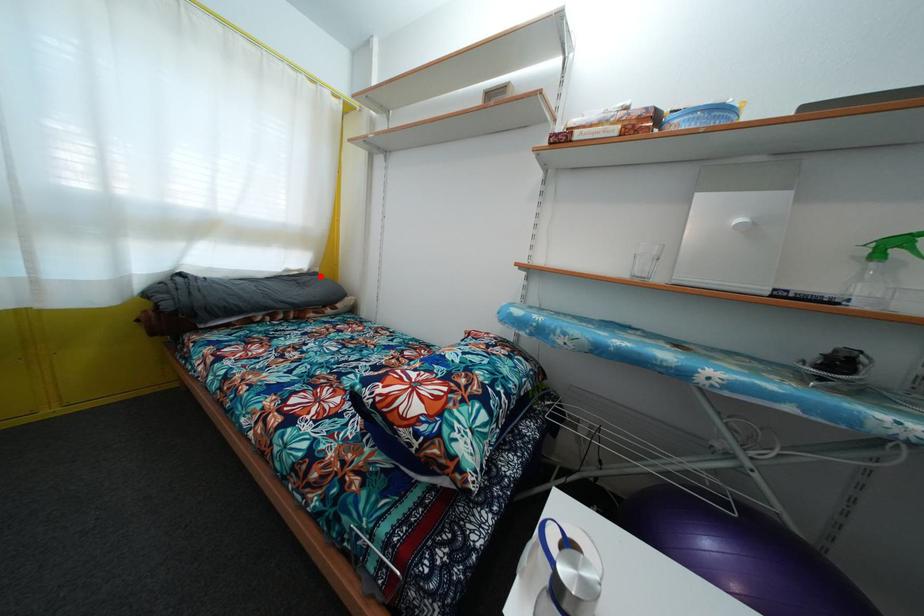
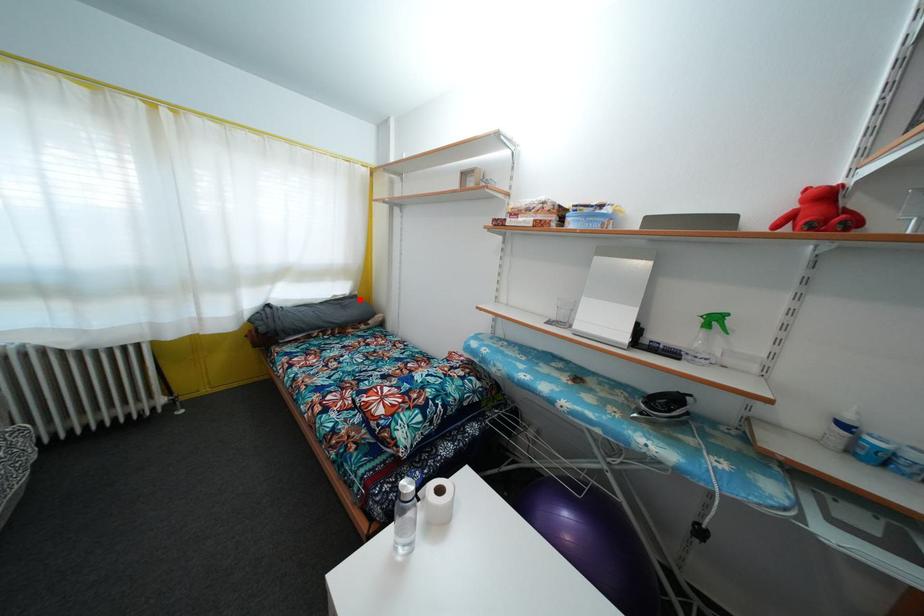
I am providing you with two images of the same scene from different viewpoints. A red point is marked on the first image and another point is marked on the second image. Do the highlighted points in image1 and image2 indicate the same real-world spot?

Yes